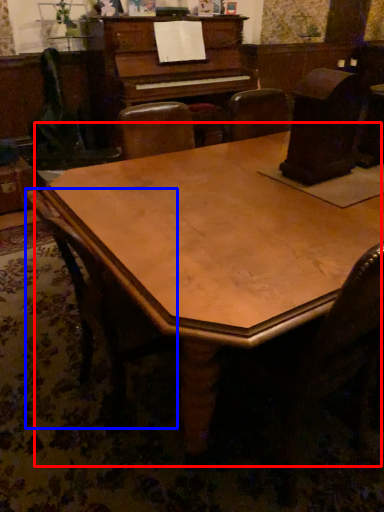
Question: Among these objects, which one is nearest to the camera, table (highlighted by a red box) or chair (highlighted by a blue box)?

Choices:
 (A) table
 (B) chair

Answer: (A)